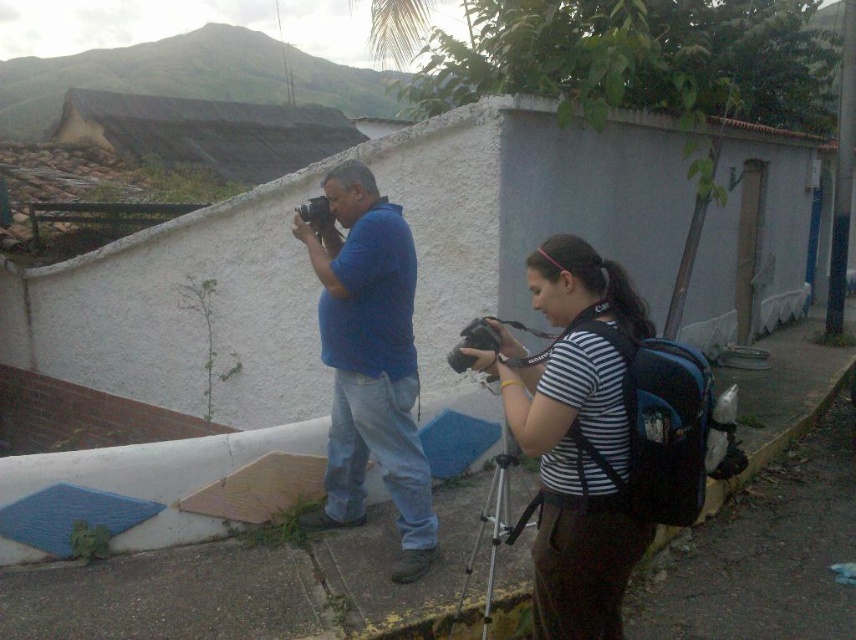
You are standing at point (473, 552) in the image and want to take a photo of the camera the man on the left is holding. Is the camera within your shooting range if your camera has a maximum focus distance of 10 feet?

The distance from point (473, 552) to the camera is 11.26 feet, which exceeds your camera maximum focus distance of 10 feet. Therefore, the camera is out of your shooting range.

You are a photographer trying to position your equipment correctly. You have a striped fabric shirt at center and a matte black camera at center. Which object is positioned to the right side?

The striped fabric shirt at center is to the right of the matte black camera at center, so the striped fabric shirt at center is positioned to the right side.